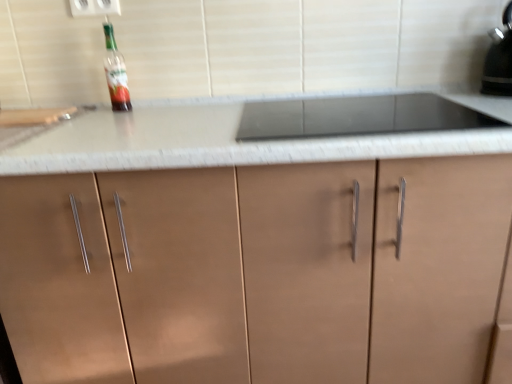
Question: Is white plastic electric outlet at upper center taller than black glossy kettle at upper right?

Choices:
 (A) no
 (B) yes

Answer: (A)

Question: Is white plastic electric outlet at upper center outside black glossy kettle at upper right?

Choices:
 (A) yes
 (B) no

Answer: (A)

Question: Is the position of white plastic electric outlet at upper center more distant than that of black glossy kettle at upper right?

Choices:
 (A) yes
 (B) no

Answer: (A)

Question: From the image's perspective, is white plastic electric outlet at upper center on top of black glossy kettle at upper right?

Choices:
 (A) yes
 (B) no

Answer: (A)

Question: Does white plastic electric outlet at upper center have a larger size compared to black glossy kettle at upper right?

Choices:
 (A) yes
 (B) no

Answer: (B)

Question: Which is correct: translucent glass bottle at upper left is inside white plastic electric outlet at upper center, or outside of it?

Choices:
 (A) outside
 (B) inside

Answer: (A)

Question: Looking at the image, does translucent glass bottle at upper left seem bigger or smaller compared to white plastic electric outlet at upper center?

Choices:
 (A) big
 (B) small

Answer: (A)

Question: Considering the positions of translucent glass bottle at upper left and white plastic electric outlet at upper center in the image, is translucent glass bottle at upper left wider or thinner than white plastic electric outlet at upper center?

Choices:
 (A) thin
 (B) wide

Answer: (B)

Question: Is point (119, 56) positioned closer to the camera than point (104, 6)?

Choices:
 (A) farther
 (B) closer

Answer: (A)

Question: Considering the positions of point (94, 3) and point (508, 48), is point (94, 3) closer or farther from the camera than point (508, 48)?

Choices:
 (A) closer
 (B) farther

Answer: (B)

Question: Is white plastic electric outlet at upper center wider or thinner than black glossy kettle at upper right?

Choices:
 (A) thin
 (B) wide

Answer: (A)

Question: In terms of size, does white plastic electric outlet at upper center appear bigger or smaller than black glossy kettle at upper right?

Choices:
 (A) small
 (B) big

Answer: (A)

Question: Is white plastic electric outlet at upper center inside or outside of black glossy kettle at upper right?

Choices:
 (A) inside
 (B) outside

Answer: (B)

Question: Relative to translucent glass bottle at upper left, is white plastic electric outlet at upper center in front or behind?

Choices:
 (A) front
 (B) behind

Answer: (B)

Question: In the image, is white plastic electric outlet at upper center on the left side or the right side of translucent glass bottle at upper left?

Choices:
 (A) right
 (B) left

Answer: (B)